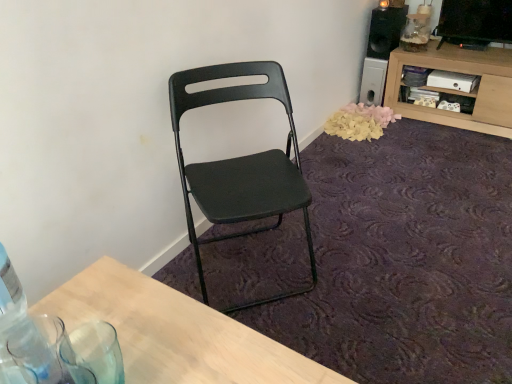
Image resolution: width=512 pixels, height=384 pixels. What are the coordinates of `clear glass bottle at lower left` in the screenshot? It's located at (25, 330).

What do you see at coordinates (25, 330) in the screenshot? I see `clear glass bottle at lower left` at bounding box center [25, 330].

What do you see at coordinates (360, 122) in the screenshot? I see `yellow paper petals at lower right` at bounding box center [360, 122].

This screenshot has width=512, height=384. In order to click on black matte speaker at upper right in this screenshot , I will do `click(385, 31)`.

Looking at this image, is black matte speaker at upper right oriented away from yellow paper petals at lower right?

No, yellow paper petals at lower right is not at the back of black matte speaker at upper right.

Identify the location of loudspeaker that is behind the yellow paper petals at lower right. (385, 31).

The image size is (512, 384). In the image, there is a wooden cabinet at upper right. In order to click on bottle below it (from the image's perspective) in this screenshot , I will do click(25, 330).

In terms of size, does wooden cabinet at upper right appear bigger or smaller than clear glass bottle at lower left?

Clearly, wooden cabinet at upper right is larger in size than clear glass bottle at lower left.

Is wooden cabinet at upper right far away from clear glass bottle at lower left?

Yes, wooden cabinet at upper right is far from clear glass bottle at lower left.

Is wooden cabinet at upper right to the right of clear glass bottle at lower left from the viewer's perspective?

Correct, you'll find wooden cabinet at upper right to the right of clear glass bottle at lower left.

Based on their positions, is yellow paper petals at lower right located to the left or right of wooden cabinet at upper right?

In the image, yellow paper petals at lower right appears on the left side of wooden cabinet at upper right.

From the image's perspective, is yellow paper petals at lower right located above or below wooden cabinet at upper right?

Based on their image positions, yellow paper petals at lower right is located beneath wooden cabinet at upper right.

Which of these two, yellow paper petals at lower right or wooden cabinet at upper right, is bigger?

With larger size is wooden cabinet at upper right.

How different are the orientations of yellow paper petals at lower right and wooden cabinet at upper right in degrees?

yellow paper petals at lower right and wooden cabinet at upper right are facing 91.3 degrees away from each other.

Is yellow paper petals at lower right positioned with its back to clear glass bottle at lower left?

No, clear glass bottle at lower left is not at the back of yellow paper petals at lower right.

Considering the sizes of yellow paper petals at lower right and clear glass bottle at lower left in the image, is yellow paper petals at lower right wider or thinner than clear glass bottle at lower left?

yellow paper petals at lower right is wider than clear glass bottle at lower left.

Considering the positions of objects yellow paper petals at lower right and clear glass bottle at lower left in the image provided, who is in front, yellow paper petals at lower right or clear glass bottle at lower left?

clear glass bottle at lower left is more forward.

Which of these two, yellow paper petals at lower right or clear glass bottle at lower left, stands shorter?

yellow paper petals at lower right.

Considering the positions of objects clear glass bottle at lower left and matte black folding chair at center in the image provided, who is more to the right, clear glass bottle at lower left or matte black folding chair at center?

From the viewer's perspective, matte black folding chair at center appears more on the right side.

Is clear glass bottle at lower left placed right next to matte black folding chair at center?

No, clear glass bottle at lower left is not beside matte black folding chair at center.

In the image, is clear glass bottle at lower left positioned in front of or behind matte black folding chair at center?

clear glass bottle at lower left is positioned closer to the viewer than matte black folding chair at center.

From the image's perspective, is clear glass bottle at lower left above or below matte black folding chair at center?

From the image's perspective, clear glass bottle at lower left appears below matte black folding chair at center.

From the picture: How many degrees apart are the facing directions of yellow paper petals at lower right and matte black folding chair at center?

The angle between the facing direction of yellow paper petals at lower right and the facing direction of matte black folding chair at center is 37 degrees.

How much distance is there between yellow paper petals at lower right and matte black folding chair at center?

yellow paper petals at lower right is 3.35 feet away from matte black folding chair at center.

From a real-world perspective, which is physically above, yellow paper petals at lower right or matte black folding chair at center?

matte black folding chair at center is physically above.

Can you confirm if yellow paper petals at lower right is smaller than matte black folding chair at center?

Correct, yellow paper petals at lower right occupies less space than matte black folding chair at center.

Is wooden cabinet at upper right facing towards yellow paper petals at lower right?

Yes, wooden cabinet at upper right is aimed at yellow paper petals at lower right.

From a real-world perspective, is wooden cabinet at upper right positioned over yellow paper petals at lower right based on gravity?

Yes, from a real-world perspective, wooden cabinet at upper right is above yellow paper petals at lower right.

Is wooden cabinet at upper right to the left or to the right of yellow paper petals at lower right in the image?

Clearly, wooden cabinet at upper right is on the right of yellow paper petals at lower right in the image.

This screenshot has height=384, width=512. Find the location of `flower that appears in front of the black matte speaker at upper right`. flower that appears in front of the black matte speaker at upper right is located at coordinates (360, 122).

You are a GUI agent. You are given a task and a screenshot of the screen. Output one action in this format:
    pyautogui.click(x=<x>, y=<y>)
    Task: Click on the bottle below the wooden cabinet at upper right (from the image's perspective)
    This screenshot has height=384, width=512.
    Given the screenshot: What is the action you would take?
    pyautogui.click(x=25, y=330)

Looking at the image, which one is located closer to wooden cabinet at upper right, yellow paper petals at lower right or matte black folding chair at center?

yellow paper petals at lower right is closer to wooden cabinet at upper right.

When comparing their distances from clear glass bottle at lower left, does matte black folding chair at center or black matte speaker at upper right seem further?

Based on the image, black matte speaker at upper right appears to be further to clear glass bottle at lower left.

Estimate the real-world distances between objects in this image. Which object is closer to clear glass bottle at lower left, yellow paper petals at lower right or matte black folding chair at center?

matte black folding chair at center.

Estimate the real-world distances between objects in this image. Which object is closer to black matte speaker at upper right, clear glass bottle at lower left or yellow paper petals at lower right?

The object closer to black matte speaker at upper right is yellow paper petals at lower right.

Looking at the image, which one is located closer to clear glass bottle at lower left, wooden cabinet at upper right or matte black folding chair at center?

matte black folding chair at center lies closer to clear glass bottle at lower left than the other object.

Estimate the real-world distances between objects in this image. Which object is closer to black matte speaker at upper right, matte black folding chair at center or yellow paper petals at lower right?

yellow paper petals at lower right.

Considering their positions, is matte black folding chair at center positioned further to yellow paper petals at lower right than wooden cabinet at upper right?

Among the two, matte black folding chair at center is located further to yellow paper petals at lower right.

Estimate the real-world distances between objects in this image. Which object is closer to black matte speaker at upper right, clear glass bottle at lower left or matte black folding chair at center?

matte black folding chair at center is positioned closer to the anchor black matte speaker at upper right.

Image resolution: width=512 pixels, height=384 pixels. I want to click on chair between clear glass bottle at lower left and black matte speaker at upper right in the front-back direction, so click(241, 165).

Where is `shelf between matte black folding chair at center and black matte speaker at upper right along the z-axis`? The image size is (512, 384). shelf between matte black folding chair at center and black matte speaker at upper right along the z-axis is located at coordinates (459, 91).

You are a GUI agent. You are given a task and a screenshot of the screen. Output one action in this format:
    pyautogui.click(x=<x>, y=<y>)
    Task: Click on the chair between clear glass bottle at lower left and wooden cabinet at upper right
    The width and height of the screenshot is (512, 384).
    Given the screenshot: What is the action you would take?
    pyautogui.click(x=241, y=165)

You are a GUI agent. You are given a task and a screenshot of the screen. Output one action in this format:
    pyautogui.click(x=<x>, y=<y>)
    Task: Click on the flower between matte black folding chair at center and black matte speaker at upper right in the front-back direction
    
    Given the screenshot: What is the action you would take?
    pyautogui.click(x=360, y=122)